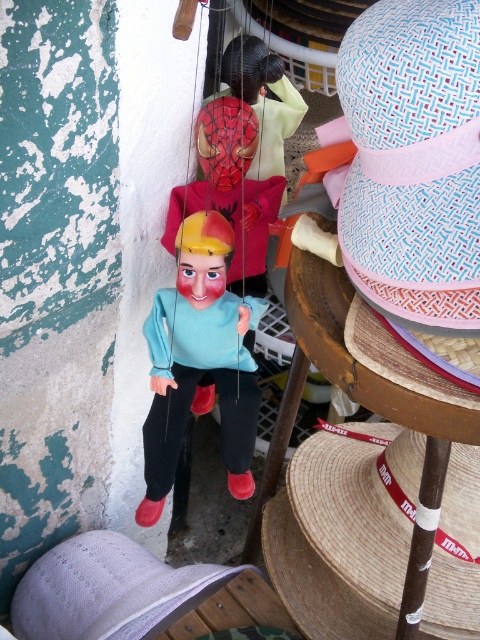
Question: Which object is the farthest from the straw hat at lower right?

Choices:
 (A) matte plastic doll at center
 (B) matte plastic puppet at center
 (C) lavender woven straw hat at lower left

Answer: (B)

Question: Is matte plastic doll at center wider than matte plastic puppet at center?

Choices:
 (A) yes
 (B) no

Answer: (A)

Question: Which point is closer to the camera?

Choices:
 (A) matte plastic puppet at center
 (B) lavender woven straw hat at lower left

Answer: (B)

Question: Does straw hat at lower right appear over lavender woven straw hat at lower left?

Choices:
 (A) no
 (B) yes

Answer: (B)

Question: Which object is the closest to the straw hat at lower right?

Choices:
 (A) matte plastic doll at center
 (B) matte plastic puppet at center

Answer: (A)

Question: Can you confirm if lavender woven straw hat at lower left is smaller than matte plastic puppet at center?

Choices:
 (A) yes
 (B) no

Answer: (A)